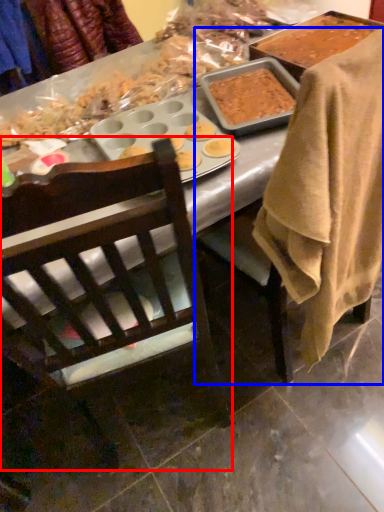
Question: Which object is closer to the camera taking this photo, chair (highlighted by a red box) or chair (highlighted by a blue box)?

Choices:
 (A) chair
 (B) chair

Answer: (A)